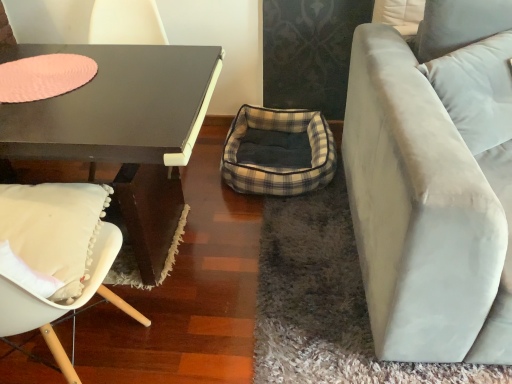
Locate an element on the screen. The height and width of the screenshot is (384, 512). free space above pink felt placemat at upper left (from a real-world perspective) is located at coordinates (33, 80).